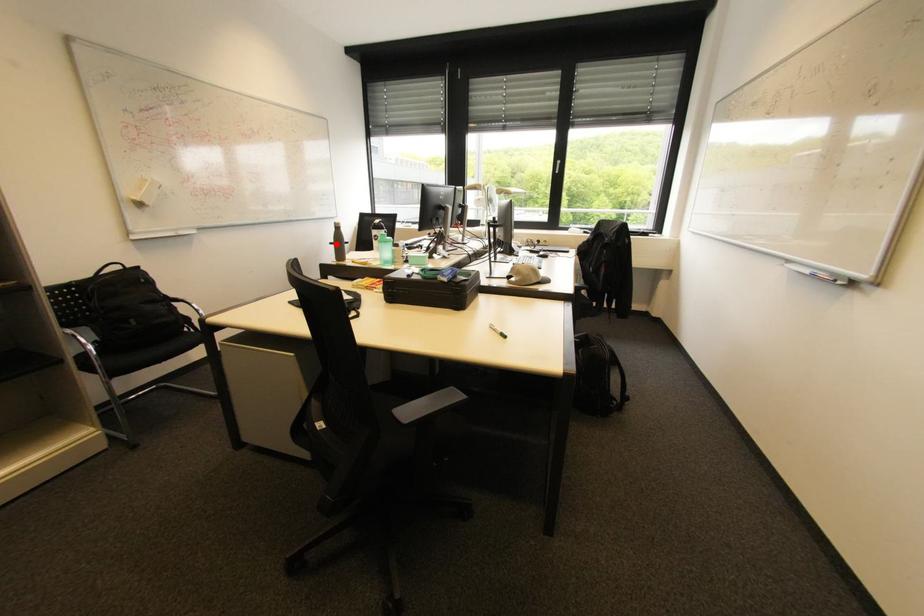
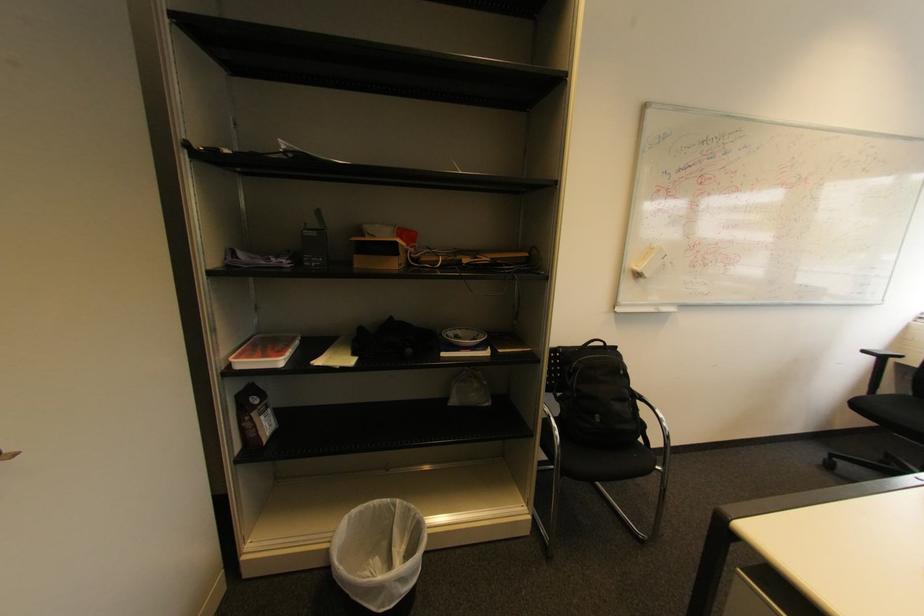
Question: I am providing you with two images of the same scene from different viewpoints. In image1, a red point is highlighted. Considering the same 3D point in image2, which of the following is correct?

Choices:
 (A) It is closer
 (B) It is farther

Answer: (B)